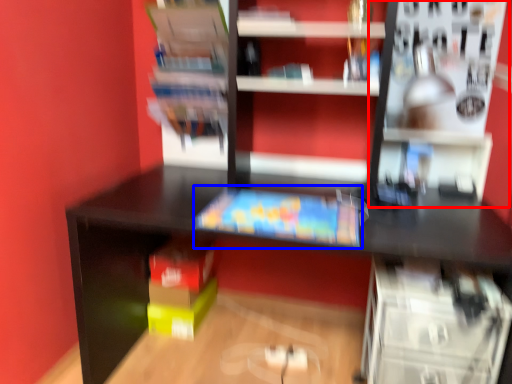
Question: Which point is closer to the camera, shelf (highlighted by a red box) or book (highlighted by a blue box)?

Choices:
 (A) shelf
 (B) book

Answer: (A)